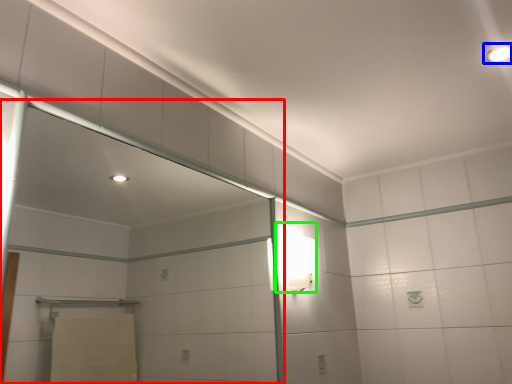
Question: Which object is the farthest from screen door (highlighted by a red box)? Choose among these: light fixture (highlighted by a blue box) or light fixture (highlighted by a green box).

Choices:
 (A) light fixture
 (B) light fixture

Answer: (A)